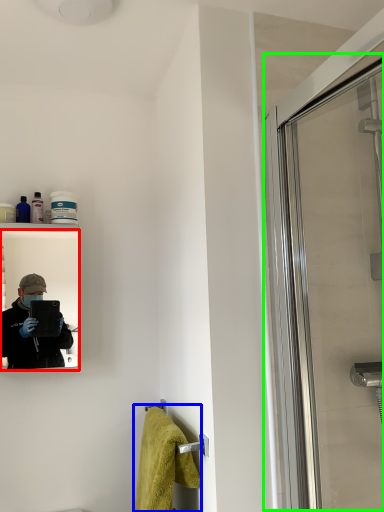
Question: Based on their relative distances, which object is farther from mirror (highlighted by a red box)? Choose from bath towel (highlighted by a blue box) and screen door (highlighted by a green box).

Choices:
 (A) bath towel
 (B) screen door

Answer: (B)